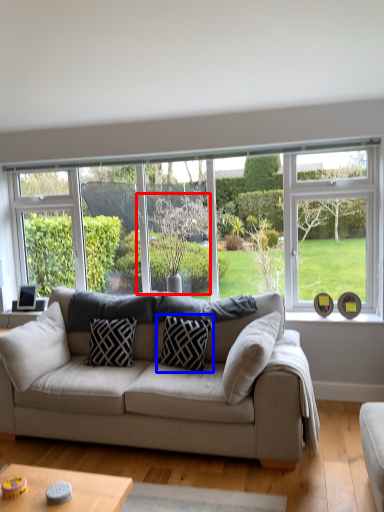
Question: Which of the following is the closest to the observer, tree (highlighted by a red box) or pillow (highlighted by a blue box)?

Choices:
 (A) tree
 (B) pillow

Answer: (B)